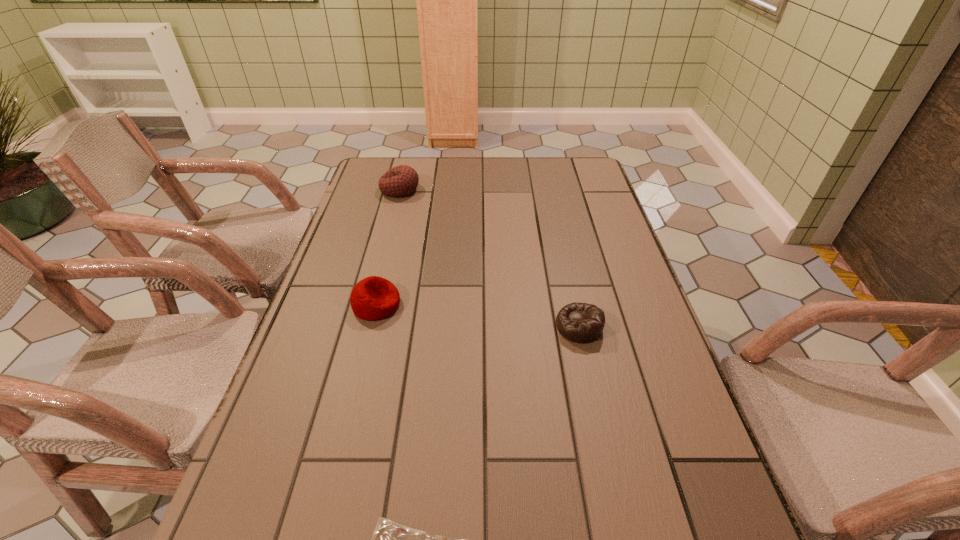
Where is `the third closest object to the farthest object`? the third closest object to the farthest object is located at coordinates (390, 539).

This screenshot has height=540, width=960. I want to click on the second closest beanbag to the third shortest object, so click(x=402, y=180).

The image size is (960, 540). I want to click on the second closest beanbag to the farthest object, so click(583, 323).

I want to click on blank area in the image that satisfies the following two spatial constraints: 1. on the front side of the farthest object; 2. on the left side of the rightmost beanbag, so click(365, 326).